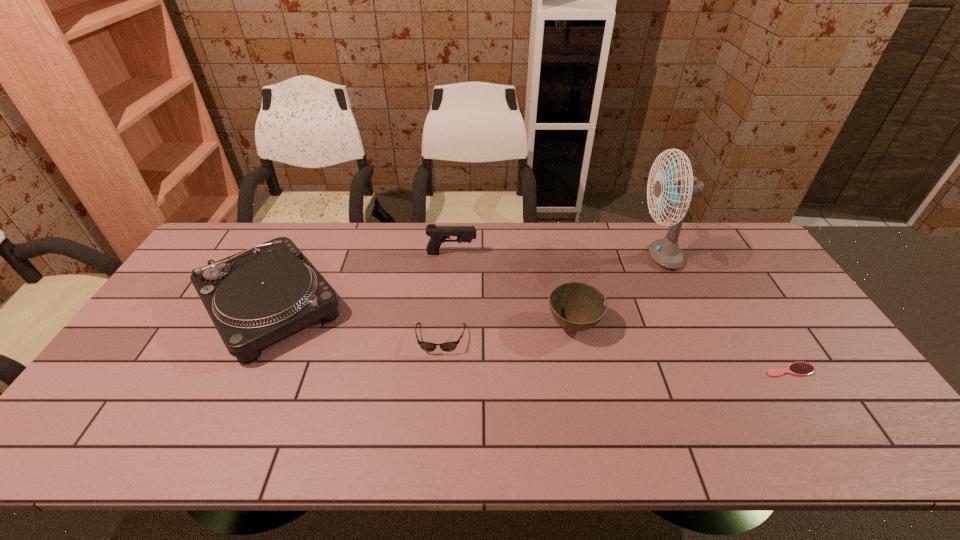
Locate an element on the screen. The image size is (960, 540). vacant area located on the front-facing side of the second object from right to left is located at coordinates (569, 256).

You are a GUI agent. You are given a task and a screenshot of the screen. Output one action in this format:
    pyautogui.click(x=<x>, y=<y>)
    Task: Click on the free space located on the front of the record player
    
    Given the screenshot: What is the action you would take?
    pyautogui.click(x=223, y=402)

The image size is (960, 540). Identify the location of free space located 0.390m at the barrel of the pistol. (591, 253).

Image resolution: width=960 pixels, height=540 pixels. I want to click on vacant space located 0.140m on the back of the third object from right to left, so click(563, 275).

Locate an element on the screen. The image size is (960, 540). free region located on the front-facing side of the second shortest object is located at coordinates (433, 421).

Locate an element on the screen. vacant region located 0.090m on the left of the shortest object is located at coordinates (730, 370).

Where is `fan located in the far edge section of the desktop`? The width and height of the screenshot is (960, 540). fan located in the far edge section of the desktop is located at coordinates (666, 252).

At what (x,y) coordinates should I click in order to perform the action: click on record player at the far edge. Please return your answer as a coordinate pair (x, y). The image size is (960, 540). Looking at the image, I should click on (254, 298).

Where is `pistol that is at the far edge`? pistol that is at the far edge is located at coordinates (438, 234).

Where is `object that is positioned at the left edge`? object that is positioned at the left edge is located at coordinates (254, 298).